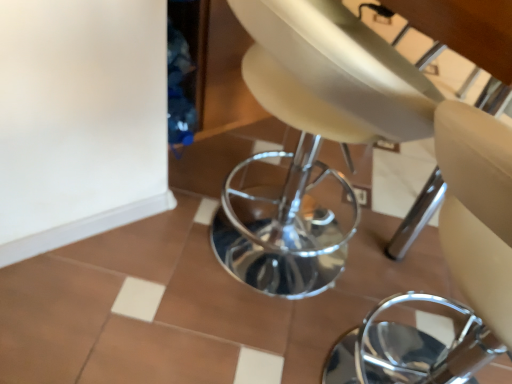
The image size is (512, 384). I want to click on vacant area that is in front of white glossy tile at lower left, so click(74, 299).